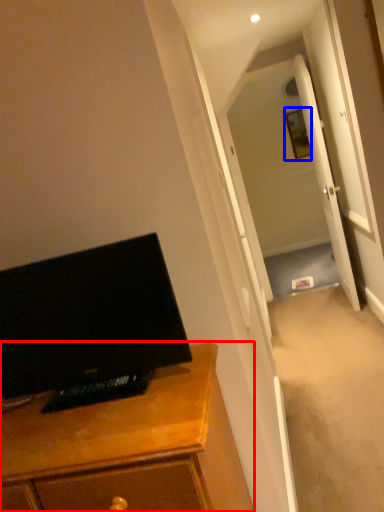
Question: Which object appears farthest to the camera in this image, cabinetry (highlighted by a red box) or picture frame (highlighted by a blue box)?

Choices:
 (A) cabinetry
 (B) picture frame

Answer: (B)